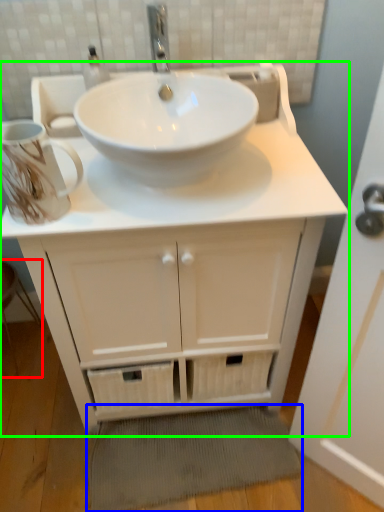
Question: Which object is the farthest from step stool (highlighted by a red box)? Choose among these: bath mat (highlighted by a blue box) or bathroom cabinet (highlighted by a green box).

Choices:
 (A) bath mat
 (B) bathroom cabinet

Answer: (B)